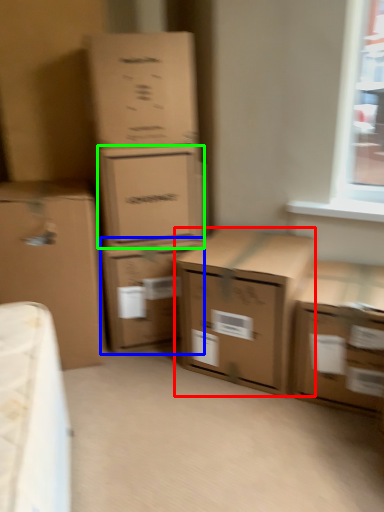
Question: Considering the real-world distances, which object is farthest from box (highlighted by a red box)? box (highlighted by a blue box) or box (highlighted by a green box)?

Choices:
 (A) box
 (B) box

Answer: (B)